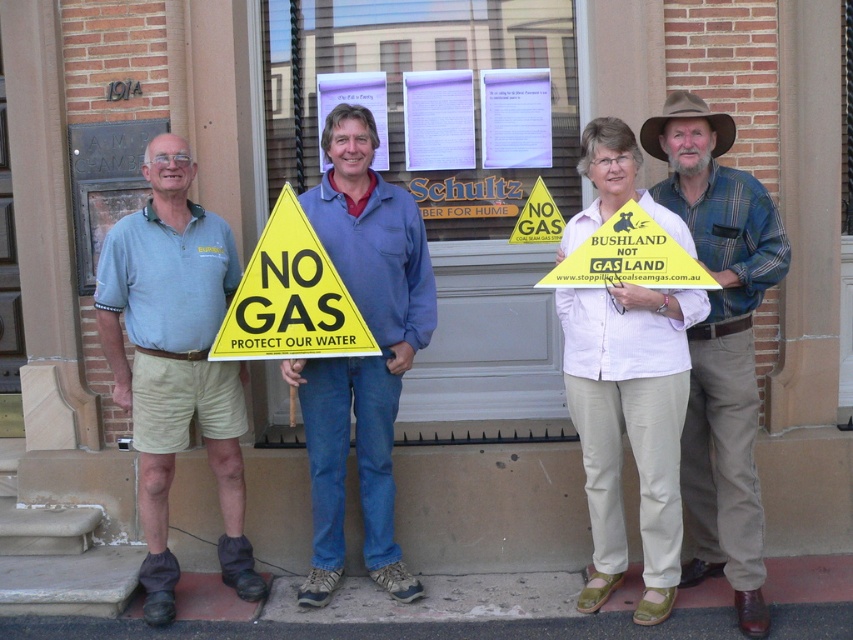
Question: Considering the real-world distances, which object is farthest from the blue denim jeans at center?

Choices:
 (A) yellow paper sign at center
 (B) light blue shirt at center

Answer: (A)

Question: Considering the relative positions of light blue shirt at center and white cotton shirt at center in the image provided, where is light blue shirt at center located with respect to white cotton shirt at center?

Choices:
 (A) above
 (B) below

Answer: (B)

Question: Does yellow paper sign at center have a larger size compared to yellow plastic triangle at center?

Choices:
 (A) no
 (B) yes

Answer: (B)

Question: Which of the following is the closest to the observer?

Choices:
 (A) (155, 506)
 (B) (659, 225)
 (C) (697, 483)
 (D) (379, 435)

Answer: (B)

Question: Is light blue shirt at center behind brown felt cowboy hat at upper center?

Choices:
 (A) no
 (B) yes

Answer: (B)

Question: Which of the following is the closest to the observer?

Choices:
 (A) (721, 196)
 (B) (322, 548)

Answer: (A)